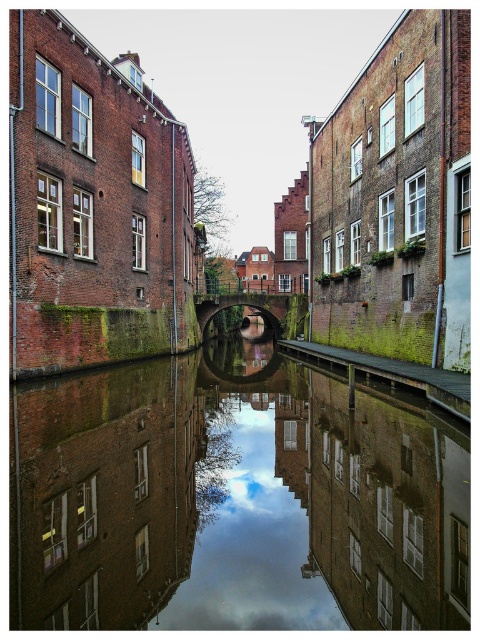
Question: Which of the following is the farthest from the observer?

Choices:
 (A) (67, 468)
 (B) (432, 384)

Answer: (B)

Question: Can you confirm if smooth reflective water at center is thinner than green mossy brick alley at lower right?

Choices:
 (A) yes
 (B) no

Answer: (B)

Question: Can you confirm if smooth reflective water at center is smaller than green mossy brick alley at lower right?

Choices:
 (A) no
 (B) yes

Answer: (A)

Question: Is smooth reflective water at center smaller than green mossy brick alley at lower right?

Choices:
 (A) no
 (B) yes

Answer: (A)

Question: Which of the following is the farthest from the observer?

Choices:
 (A) smooth reflective water at center
 (B) green mossy brick alley at lower right

Answer: (B)